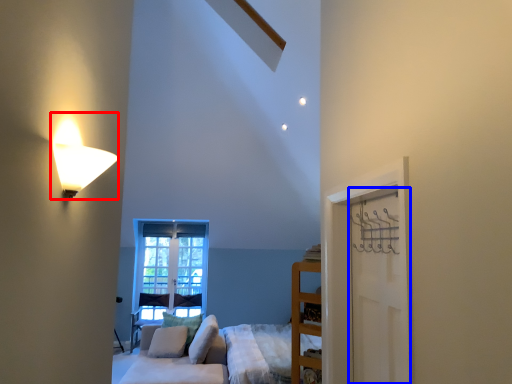
Question: Which of the following is the closest to the observer, lamp (highlighted by a red box) or door (highlighted by a blue box)?

Choices:
 (A) lamp
 (B) door

Answer: (A)